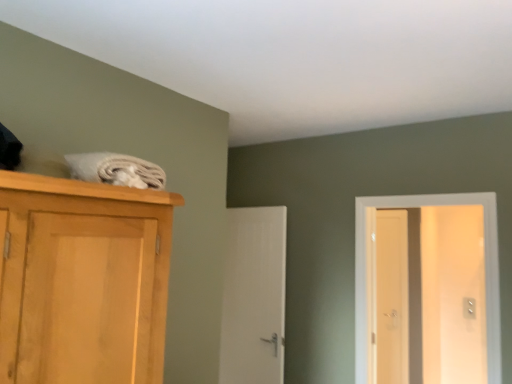
Question: Would you say white glossy door at right, which ranks as the 1th door in right-to-left order, is part of light brown wooden screen door at right's contents?

Choices:
 (A) no
 (B) yes

Answer: (A)

Question: From the image's perspective, is light brown wooden screen door at right located beneath white glossy door at right, which ranks as the 2th door in left-to-right order?

Choices:
 (A) yes
 (B) no

Answer: (A)

Question: From a real-world perspective, is light brown wooden screen door at right physically below white glossy door at right, which ranks as the 1th door in right-to-left order?

Choices:
 (A) yes
 (B) no

Answer: (A)

Question: Does light brown wooden screen door at right have a lesser width compared to white glossy door at right, which ranks as the 1th door in right-to-left order?

Choices:
 (A) no
 (B) yes

Answer: (B)

Question: Can you confirm if light brown wooden screen door at right is taller than white glossy door at right, which ranks as the 2th door in left-to-right order?

Choices:
 (A) no
 (B) yes

Answer: (B)

Question: Relative to light brown wooden screen door at right, is white smooth door at center, which is the 1th door in back-to-front order, in front or behind?

Choices:
 (A) front
 (B) behind

Answer: (A)

Question: Is white smooth door at center, which is counted as the second door, starting from the front, taller or shorter than light brown wooden screen door at right?

Choices:
 (A) short
 (B) tall

Answer: (A)

Question: In terms of size, does white smooth door at center, which is counted as the second door, starting from the front, appear bigger or smaller than light brown wooden screen door at right?

Choices:
 (A) small
 (B) big

Answer: (B)

Question: From a real-world perspective, is white smooth door at center, which is the 1th door in back-to-front order, above or below light brown wooden screen door at right?

Choices:
 (A) above
 (B) below

Answer: (A)

Question: Is point (489, 380) closer or farther from the camera than point (221, 352)?

Choices:
 (A) farther
 (B) closer

Answer: (B)

Question: Is white glossy door at right, which ranks as the 1th door in right-to-left order, wider or thinner than white smooth door at center, which is counted as the second door, starting from the front?

Choices:
 (A) thin
 (B) wide

Answer: (B)

Question: Considering their positions, is white glossy door at right, which ranks as the 2th door in left-to-right order, located in front of or behind white smooth door at center, which is counted as the first door, starting from the left?

Choices:
 (A) behind
 (B) front

Answer: (B)

Question: From the image's perspective, is white glossy door at right, which ranks as the 2th door in left-to-right order, located above or below white smooth door at center, which is counted as the first door, starting from the left?

Choices:
 (A) above
 (B) below

Answer: (A)

Question: Considering their positions, is light brown wooden screen door at right located in front of or behind white smooth door at center, which is counted as the first door, starting from the left?

Choices:
 (A) front
 (B) behind

Answer: (B)

Question: From their relative heights in the image, would you say light brown wooden screen door at right is taller or shorter than white smooth door at center, which is the 1th door in back-to-front order?

Choices:
 (A) tall
 (B) short

Answer: (A)